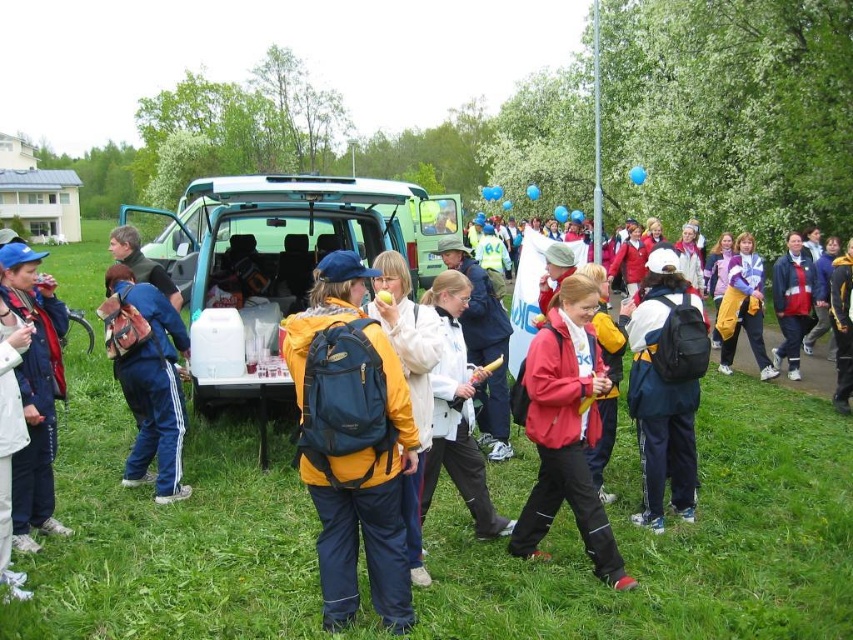
Is matte blue backpack at center taller than white matte jacket at left?

Yes.

Does matte blue backpack at center have a smaller size compared to white matte jacket at left?

No, matte blue backpack at center is not smaller than white matte jacket at left.

I want to click on matte blue backpack at center, so click(x=352, y=444).

From the picture: Can you confirm if matte red jacket at center is wider than yellow matte backpack at center?

Yes, matte red jacket at center is wider than yellow matte backpack at center.

Is point (535, 404) farther from camera compared to point (415, 364)?

Yes, point (535, 404) is behind point (415, 364).

This screenshot has height=640, width=853. In order to click on matte red jacket at center in this screenshot , I will do `click(566, 429)`.

Can you confirm if blue synthetic backpack at center is wider than yellow fabric jacket at center?

Yes.

The width and height of the screenshot is (853, 640). Identify the location of blue synthetic backpack at center. (148, 378).